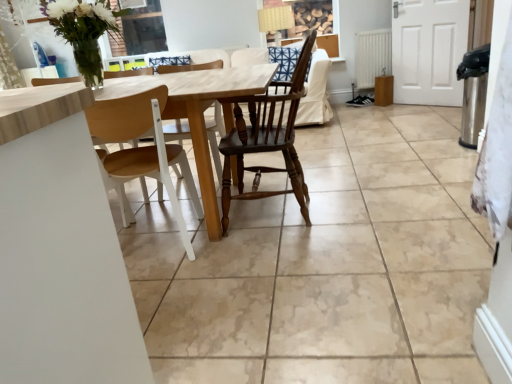
Find the location of `free space on the front side of wooden at left, placed as the first chair when sorted from left to right`. free space on the front side of wooden at left, placed as the first chair when sorted from left to right is located at coordinates (175, 285).